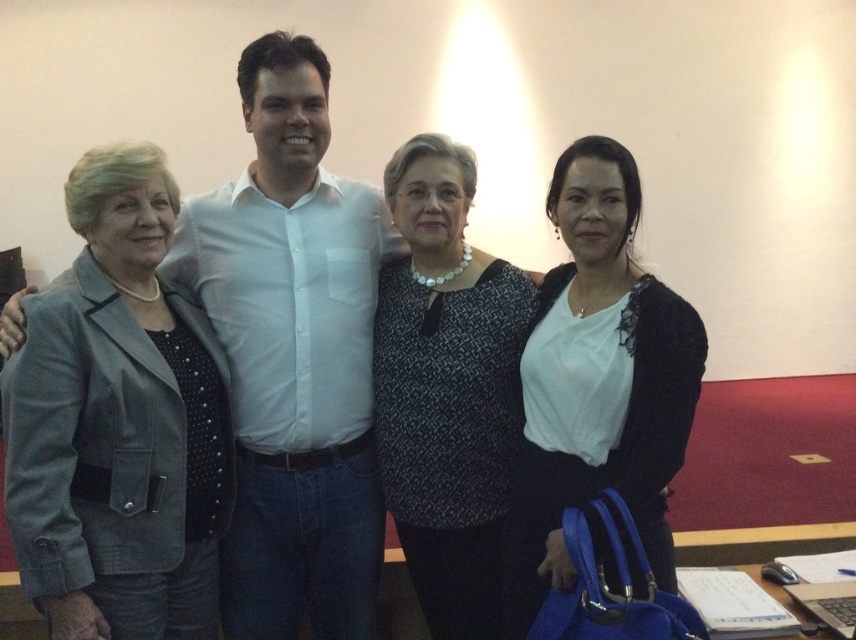
Between white matte shirt at center and patterned fabric blouse at center, which one has less height?

Standing shorter between the two is white matte shirt at center.

Does white matte shirt at center appear on the left side of patterned fabric blouse at center?

No, white matte shirt at center is not to the left of patterned fabric blouse at center.

Where is `white matte shirt at center`? The width and height of the screenshot is (856, 640). white matte shirt at center is located at coordinates (598, 385).

Does gray fabric jacket at left have a lesser height compared to white matte shirt at center?

Indeed, gray fabric jacket at left has a lesser height compared to white matte shirt at center.

Is point (198, 324) positioned in front of point (604, 259)?

No, it is not.

Which is behind, point (117, 355) or point (556, 438)?

Positioned behind is point (556, 438).

The height and width of the screenshot is (640, 856). I want to click on gray fabric jacket at left, so click(x=117, y=422).

Between gray fabric jacket at left and patterned fabric blouse at center, which one appears on the left side from the viewer's perspective?

gray fabric jacket at left

Between gray fabric jacket at left and patterned fabric blouse at center, which one is positioned higher?

gray fabric jacket at left is above.

Between point (52, 448) and point (516, 392), which one is positioned in front?

Point (52, 448) is in front.

The image size is (856, 640). Find the location of `gray fabric jacket at left`. gray fabric jacket at left is located at coordinates (117, 422).